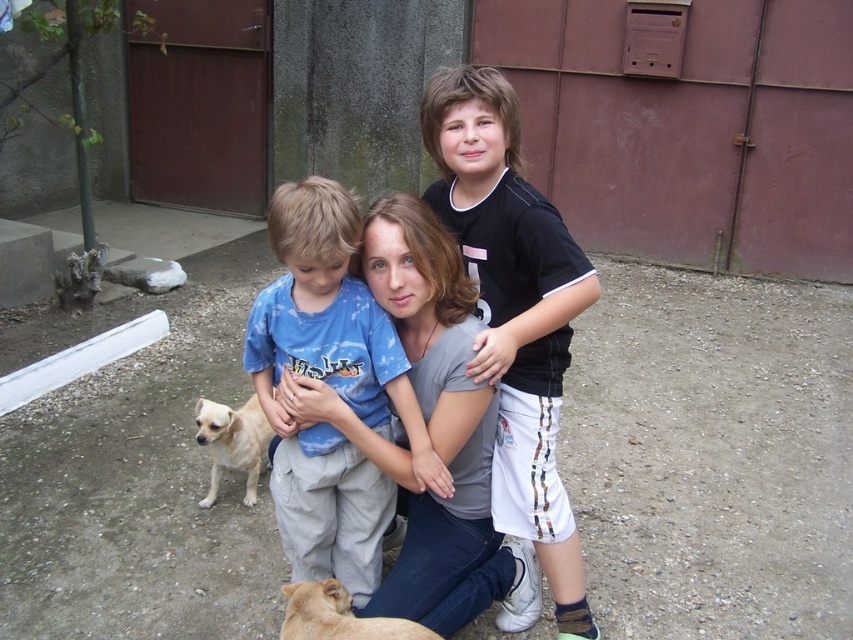
Question: Is black cotton shirt at center wider than light brown fur at lower left?

Choices:
 (A) yes
 (B) no

Answer: (A)

Question: Estimate the real-world distances between objects in this image. Which object is closer to the light brown fur at lower left?

Choices:
 (A) blue tie-dye t-shirt at center
 (B) light brown fur at lower center
 (C) black cotton shirt at center

Answer: (A)

Question: Which point appears farthest from the camera in this image?

Choices:
 (A) (445, 93)
 (B) (253, 444)
 (C) (317, 586)
 (D) (339, 564)

Answer: (B)

Question: Based on their relative distances, which object is farther from the light brown fur at lower center?

Choices:
 (A) blue tie-dye t-shirt at center
 (B) black cotton shirt at center

Answer: (B)

Question: Observing the image, what is the correct spatial positioning of light brown fur at lower center in reference to light brown fur at lower left?

Choices:
 (A) above
 (B) below

Answer: (B)

Question: Can you confirm if blue tie-dye t-shirt at center is positioned to the left of light brown fur at lower left?

Choices:
 (A) no
 (B) yes

Answer: (A)